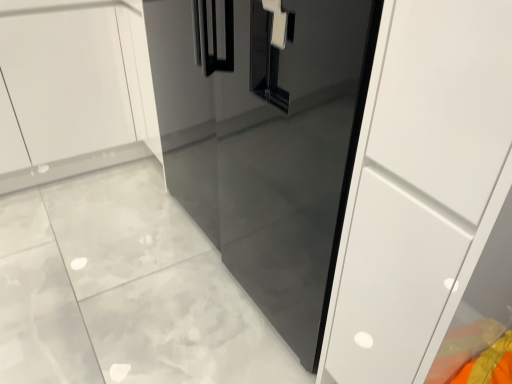
At what (x,y) coordinates should I click in order to perform the action: click on glossy black door at center. Please return your answer as a coordinate pair (x, y). Looking at the image, I should click on (265, 141).

Measure the distance between glossy black door at center and camera.

The depth of glossy black door at center is 28.01 inches.

The image size is (512, 384). What do you see at coordinates (265, 141) in the screenshot?
I see `glossy black door at center` at bounding box center [265, 141].

Locate an element on the screen. glossy black door at center is located at coordinates (265, 141).